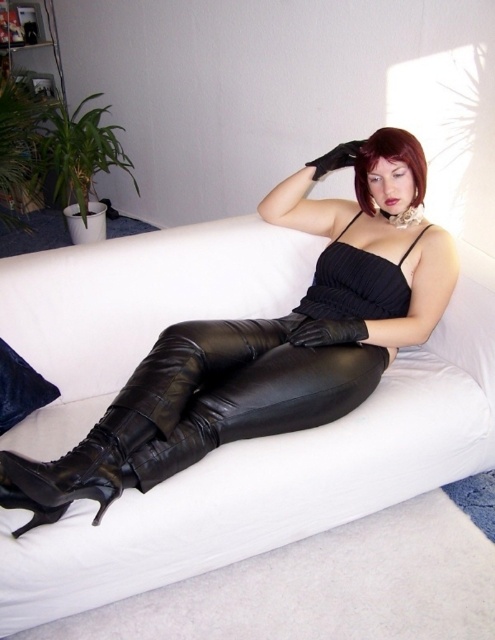
Is white leather couch at center wider than black leather glove at center?

Yes.

Describe the element at coordinates (275, 477) in the screenshot. The image size is (495, 640). I see `white leather couch at center` at that location.

Who is more forward, (140, 588) or (346, 333)?

Point (140, 588) is more forward.

You are a GUI agent. You are given a task and a screenshot of the screen. Output one action in this format:
    pyautogui.click(x=<x>, y=<y>)
    Task: Click on the white leather couch at center
    
    Given the screenshot: What is the action you would take?
    pyautogui.click(x=275, y=477)

Can you confirm if white leather couch at center is shorter than black leather dress at center?

In fact, white leather couch at center may be taller than black leather dress at center.

Which is behind, point (64, 422) or point (366, 316)?

Positioned behind is point (366, 316).

Is point (231, 529) more distant than point (130, 381)?

No.

I want to click on white leather couch at center, so click(x=275, y=477).

Who is positioned more to the left, black leather dress at center or black leather glove at center?

Positioned to the left is black leather dress at center.

Can you confirm if black leather dress at center is positioned to the right of black leather glove at center?

No, black leather dress at center is not to the right of black leather glove at center.

Where is `black leather dress at center`? This screenshot has height=640, width=495. black leather dress at center is located at coordinates 260,369.